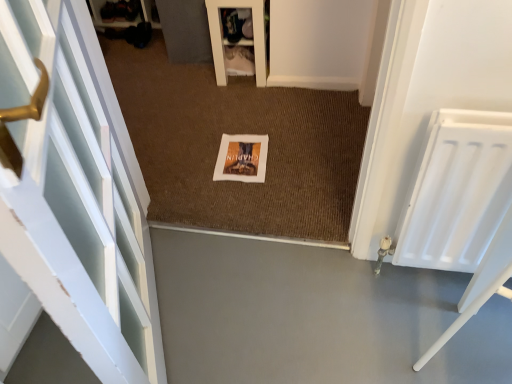
What are the coordinates of `empty space that is in between white painted wood door at left and white matte radiator at right` in the screenshot? It's located at (293, 311).